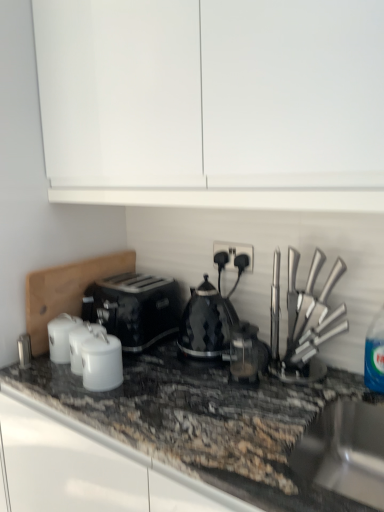
Image resolution: width=384 pixels, height=512 pixels. What are the coordinates of `blue plastic bottle at right` in the screenshot? It's located at (375, 354).

What do you see at coordinates (375, 354) in the screenshot? I see `blue plastic bottle at right` at bounding box center [375, 354].

At what (x,y) coordinates should I click in order to perform the action: click on stainless steel sink at lower right. Please return your answer as a coordinate pair (x, y). This screenshot has width=384, height=512. Looking at the image, I should click on (345, 451).

At what (x,y) coordinates should I click in order to perform the action: click on white glossy canister at center, which appears as the third kitchen appliance when viewed from the right. Please return your answer as a coordinate pair (x, y). This screenshot has width=384, height=512. Looking at the image, I should click on (102, 362).

The width and height of the screenshot is (384, 512). Describe the element at coordinates (234, 254) in the screenshot. I see `black plastic socket at center` at that location.

This screenshot has height=512, width=384. What do you see at coordinates (206, 323) in the screenshot?
I see `black diamond-patterned kettle at center, placed as the 2th kitchen appliance when sorted from right to left` at bounding box center [206, 323].

In order to click on black matte toaster at center in this screenshot , I will do `click(134, 308)`.

What do you see at coordinates (134, 308) in the screenshot? The height and width of the screenshot is (512, 384). I see `black matte toaster at center` at bounding box center [134, 308].

What do you see at coordinates (246, 353) in the screenshot?
I see `satin black coffee machine at center` at bounding box center [246, 353].

Where is `blue plastic bottle at right`? The height and width of the screenshot is (512, 384). blue plastic bottle at right is located at coordinates (375, 354).

Is black matte toaster at center to the right of blue plastic bottle at right from the viewer's perspective?

Incorrect, black matte toaster at center is not on the right side of blue plastic bottle at right.

From a real-world perspective, between black matte toaster at center and blue plastic bottle at right, who is vertically higher?

blue plastic bottle at right is physically above.

Choose the correct answer: Is black matte toaster at center inside blue plastic bottle at right or outside it?

black matte toaster at center is not inside blue plastic bottle at right, it's outside.

Is black matte toaster at center facing towards blue plastic bottle at right?

No, black matte toaster at center is not turned towards blue plastic bottle at right.

From the picture: Is white glossy canisters at center, the 1th kitchen appliance in the left-to-right sequence, positioned with its back to satin black coffee machine at center?

white glossy canisters at center, the 1th kitchen appliance in the left-to-right sequence, does not have its back to satin black coffee machine at center.

Is white glossy canisters at center, the 1th kitchen appliance in the left-to-right sequence, behind satin black coffee machine at center?

Yes, it is behind satin black coffee machine at center.

Looking at this image, is white glossy canisters at center, the 1th kitchen appliance in the left-to-right sequence, far from satin black coffee machine at center?

They are positioned close to each other.

Choose the correct answer: Is white glossy canisters at center, which is the fourth kitchen appliance in right-to-left order, inside satin black coffee machine at center or outside it?

white glossy canisters at center, which is the fourth kitchen appliance in right-to-left order, is outside satin black coffee machine at center.

Considering the positions of points (166, 284) and (317, 314), is point (166, 284) closer to camera compared to point (317, 314)?

No, (166, 284) is behind (317, 314).

Considering the sizes of objects black matte toaster at center and polished stainless steel knife set at right, placed as the 4th kitchen appliance when sorted from left to right, in the image provided, who is smaller, black matte toaster at center or polished stainless steel knife set at right, placed as the 4th kitchen appliance when sorted from left to right,?

With smaller size is polished stainless steel knife set at right, placed as the 4th kitchen appliance when sorted from left to right.

From the image's perspective, would you say black matte toaster at center is shown under polished stainless steel knife set at right, placed as the 4th kitchen appliance when sorted from left to right?

Correct, black matte toaster at center appears lower than polished stainless steel knife set at right, placed as the 4th kitchen appliance when sorted from left to right, in the image.

Choose the correct answer: Is black matte toaster at center inside polished stainless steel knife set at right, placed as the 4th kitchen appliance when sorted from left to right, or outside it?

black matte toaster at center is not enclosed by polished stainless steel knife set at right, placed as the 4th kitchen appliance when sorted from left to right.

Which kitchen appliance is the 3rd one when counting from the right side of the white glossy canisters at center, which is the fourth kitchen appliance in right-to-left order? Please provide its 2D coordinates.

[(309, 324)]

From the image's perspective, is polished stainless steel knife set at right, placed as the 4th kitchen appliance when sorted from left to right, located above white glossy canisters at center, the 1th kitchen appliance in the left-to-right sequence?

Yes, from the image's perspective, polished stainless steel knife set at right, placed as the 4th kitchen appliance when sorted from left to right, is over white glossy canisters at center, the 1th kitchen appliance in the left-to-right sequence.

Which of these two, polished stainless steel knife set at right, placed as the 4th kitchen appliance when sorted from left to right, or white glossy canisters at center, the 1th kitchen appliance in the left-to-right sequence, is bigger?

With larger size is polished stainless steel knife set at right, placed as the 4th kitchen appliance when sorted from left to right.

Is polished stainless steel knife set at right, placed as the 4th kitchen appliance when sorted from left to right, beside white glossy canisters at center, the 1th kitchen appliance in the left-to-right sequence?

No.

Is black plastic socket at center bigger than blue plastic bottle at right?

Incorrect, black plastic socket at center is not larger than blue plastic bottle at right.

Between black plastic socket at center and blue plastic bottle at right, which one has less height?

With less height is black plastic socket at center.

Considering the sizes of black plastic socket at center and blue plastic bottle at right in the image, is black plastic socket at center wider or thinner than blue plastic bottle at right?

black plastic socket at center is thinner than blue plastic bottle at right.

What's the angular difference between black plastic socket at center and blue plastic bottle at right's facing directions?

They differ by 0.94 degrees in their facing directions.

Considering the points (338, 325) and (352, 436), which point is in front, point (338, 325) or point (352, 436)?

The point (338, 325) is closer.

Who is shorter, polished stainless steel knife set at right, placed as the 4th kitchen appliance when sorted from left to right, or stainless steel sink at lower right?

stainless steel sink at lower right is shorter.

Could you tell me if polished stainless steel knife set at right, placed as the 4th kitchen appliance when sorted from left to right, is facing stainless steel sink at lower right?

No, polished stainless steel knife set at right, placed as the 4th kitchen appliance when sorted from left to right, does not turn towards stainless steel sink at lower right.

What's the angular difference between polished stainless steel knife set at right, the first kitchen appliance when ordered from right to left, and stainless steel sink at lower right's facing directions?

They differ by 0.00189 degrees in their facing directions.

Does blue plastic bottle at right turn towards black plastic socket at center?

No, blue plastic bottle at right is not facing towards black plastic socket at center.

Is blue plastic bottle at right bigger than black plastic socket at center?

Yes, blue plastic bottle at right is bigger than black plastic socket at center.

From a real-world perspective, between blue plastic bottle at right and black plastic socket at center, who is vertically lower?

From a 3D spatial view, blue plastic bottle at right is below.

At what (x,y) coordinates should I click in order to perform the action: click on bottle located on the right of black matte toaster at center. Please return your answer as a coordinate pair (x, y). This screenshot has height=512, width=384. Looking at the image, I should click on (375, 354).

From the satin black coffee machine at center, count the 3rd kitchen appliance to the left and point to it. Please provide its 2D coordinates.

[(82, 342)]

Looking at the image, which one is located further to polished stainless steel knife set at right, the first kitchen appliance when ordered from right to left, black plastic socket at center or satin black coffee machine at center?

Based on the image, black plastic socket at center appears to be further to polished stainless steel knife set at right, the first kitchen appliance when ordered from right to left.

In the scene shown: Looking at the image, which one is located closer to polished stainless steel knife set at right, the first kitchen appliance when ordered from right to left, satin black coffee machine at center or black plastic socket at center?

The object closer to polished stainless steel knife set at right, the first kitchen appliance when ordered from right to left, is satin black coffee machine at center.

Considering their positions, is white glossy canisters at center, the 1th kitchen appliance in the left-to-right sequence, positioned closer to black plastic socket at center than black diamond-patterned kettle at center, placed as the 2th kitchen appliance when sorted from right to left?

The object closer to black plastic socket at center is black diamond-patterned kettle at center, placed as the 2th kitchen appliance when sorted from right to left.

When comparing their distances from black matte toaster at center, does white glossy canisters at center, which is the fourth kitchen appliance in right-to-left order, or black diamond-patterned kettle at center, placed as the third kitchen appliance when sorted from left to right, seem closer?

Based on the image, white glossy canisters at center, which is the fourth kitchen appliance in right-to-left order, appears to be nearer to black matte toaster at center.

From the image, which object appears to be nearer to stainless steel sink at lower right, black diamond-patterned kettle at center, placed as the third kitchen appliance when sorted from left to right, or black matte toaster at center?

black diamond-patterned kettle at center, placed as the third kitchen appliance when sorted from left to right, is positioned closer to the anchor stainless steel sink at lower right.

When comparing their distances from satin black coffee machine at center, does polished stainless steel knife set at right, placed as the 4th kitchen appliance when sorted from left to right, or black matte toaster at center seem closer?

polished stainless steel knife set at right, placed as the 4th kitchen appliance when sorted from left to right, is closer to satin black coffee machine at center.

Considering their positions, is black plastic socket at center positioned closer to satin black coffee machine at center than polished stainless steel knife set at right, placed as the 4th kitchen appliance when sorted from left to right?

Among the two, polished stainless steel knife set at right, placed as the 4th kitchen appliance when sorted from left to right, is located nearer to satin black coffee machine at center.

When comparing their distances from stainless steel sink at lower right, does black diamond-patterned kettle at center, placed as the third kitchen appliance when sorted from left to right, or satin black coffee machine at center seem closer?

Among the two, satin black coffee machine at center is located nearer to stainless steel sink at lower right.

In order to click on electric outlet between white glossy canister at center, which appears as the third kitchen appliance when viewed from the right, and polished stainless steel knife set at right, placed as the 4th kitchen appliance when sorted from left to right, from left to right in this screenshot , I will do `click(234, 254)`.

The height and width of the screenshot is (512, 384). Find the location of `electric outlet between black matte toaster at center and blue plastic bottle at right`. electric outlet between black matte toaster at center and blue plastic bottle at right is located at coordinates (234, 254).

Where is `toaster between white glossy canisters at center, the 1th kitchen appliance in the left-to-right sequence, and blue plastic bottle at right`? toaster between white glossy canisters at center, the 1th kitchen appliance in the left-to-right sequence, and blue plastic bottle at right is located at coordinates (134, 308).

Find the location of a particular element. This screenshot has width=384, height=512. kitchen appliance situated between black diamond-patterned kettle at center, placed as the 2th kitchen appliance when sorted from right to left, and blue plastic bottle at right from left to right is located at coordinates (309, 324).